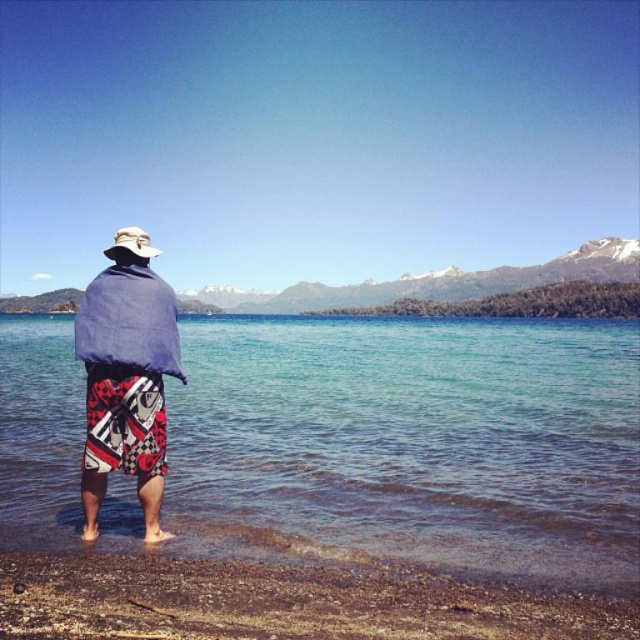
Question: Considering the real-world distances, which object is closest to the white fabric hat at upper center?

Choices:
 (A) snowy rock mountain at upper center
 (B) clear water at lower center
 (C) blue cotton robe at center

Answer: (C)

Question: Which point is farther to the camera?

Choices:
 (A) blue cotton robe at center
 (B) snowy rock mountain at upper center
 (C) white fabric hat at upper center
 (D) clear water at lower center

Answer: (B)

Question: Among these objects, which one is nearest to the camera?

Choices:
 (A) clear water at lower center
 (B) blue cotton robe at center
 (C) snowy rock mountain at upper center

Answer: (A)

Question: Can you confirm if clear water at lower center is positioned above white fabric hat at upper center?

Choices:
 (A) yes
 (B) no

Answer: (B)

Question: Is the position of clear water at lower center more distant than that of white fabric hat at upper center?

Choices:
 (A) no
 (B) yes

Answer: (A)

Question: Does blue cotton robe at center have a larger size compared to snowy rock mountain at upper center?

Choices:
 (A) yes
 (B) no

Answer: (B)